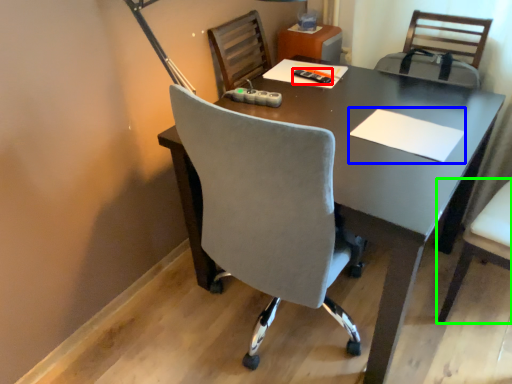
Question: Which is nearer to the stationery (highlighted by a red box)? notepad (highlighted by a blue box) or chair (highlighted by a green box).

Choices:
 (A) notepad
 (B) chair

Answer: (A)